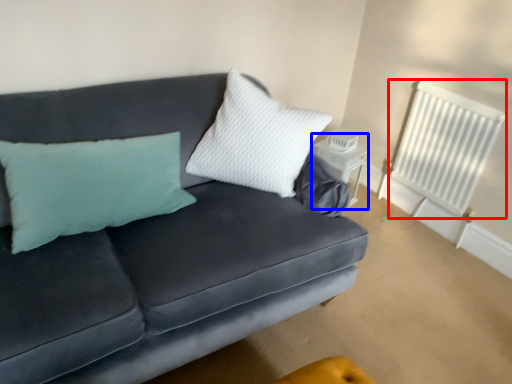
Question: Which object appears closest to the camera in this image, radiator (highlighted by a red box) or table (highlighted by a blue box)?

Choices:
 (A) radiator
 (B) table

Answer: (A)